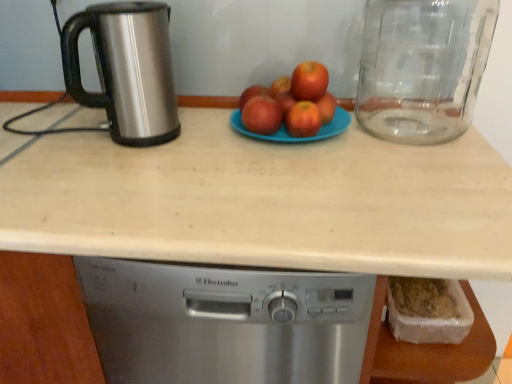
Identify the location of free location to the right of stainless steel kettle at left. (213, 139).